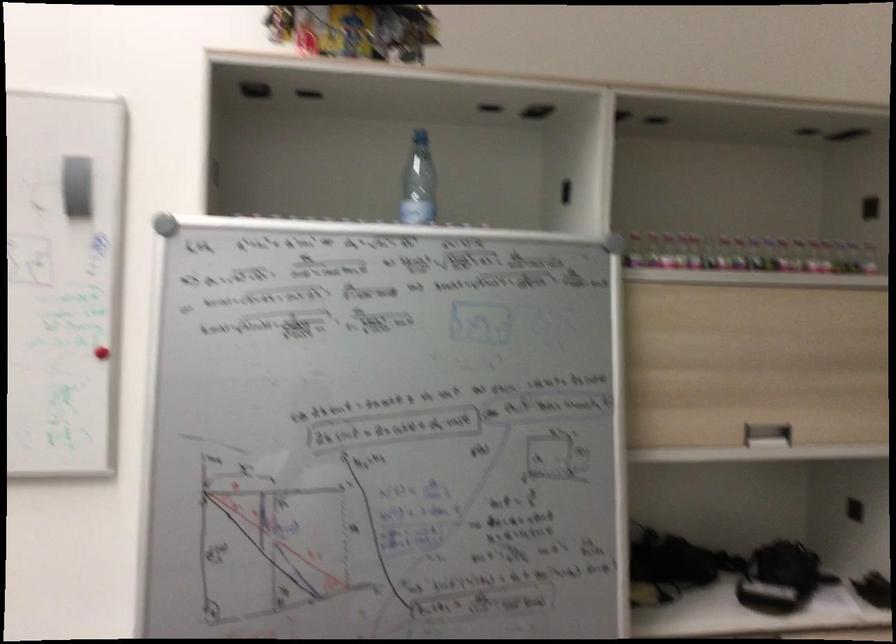
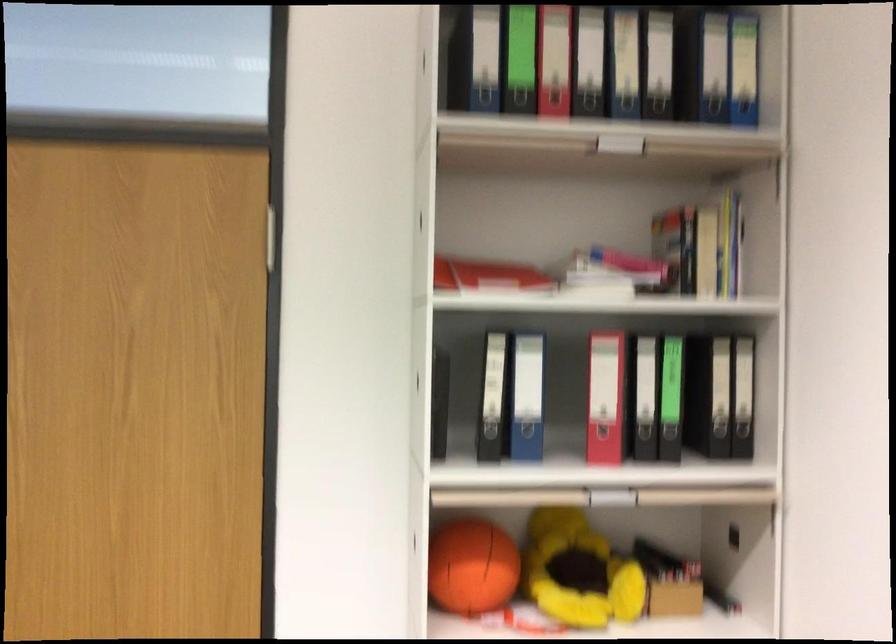
Question: The first image is from the beginning of the video and the second image is from the end. How did the camera likely rotate when shooting the video?

Choices:
 (A) Left
 (B) Right
 (C) Up
 (D) Down

Answer: (B)